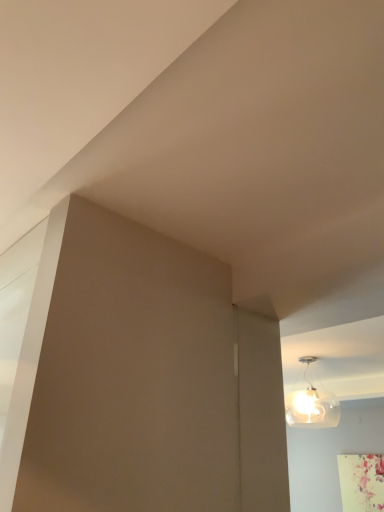
Where is `translucent glass lampshade at upper right`? translucent glass lampshade at upper right is located at coordinates [x=310, y=401].

What do you see at coordinates (310, 401) in the screenshot?
I see `translucent glass lampshade at upper right` at bounding box center [310, 401].

Find the location of a particular element. Image resolution: width=384 pixels, height=512 pixels. translucent glass lampshade at upper right is located at coordinates (310, 401).